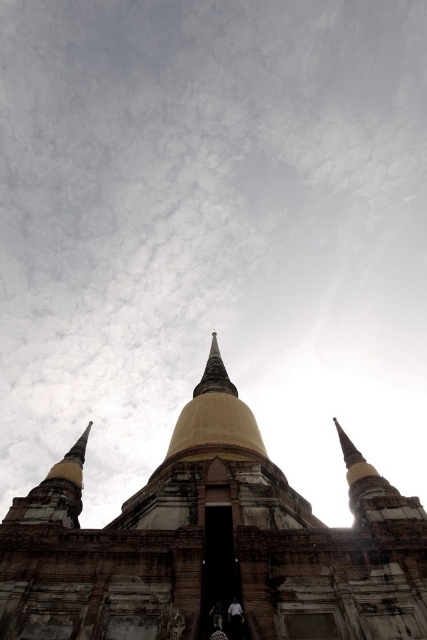
You are standing at the point marked by the coordinates point (x=213, y=547) in the temple scene. Describe the immediate surroundings of this point based on the temple structure described.

The gold golden stone temple at center is located at point (x=213, y=547), so the immediate surroundings of this point would include the central spire of the temple, which is larger than the two flanking ones, and the aged brickwork and stone details characteristic of the temple structure. The entrance area, with its dark and shadowy entrance, is nearby as well.